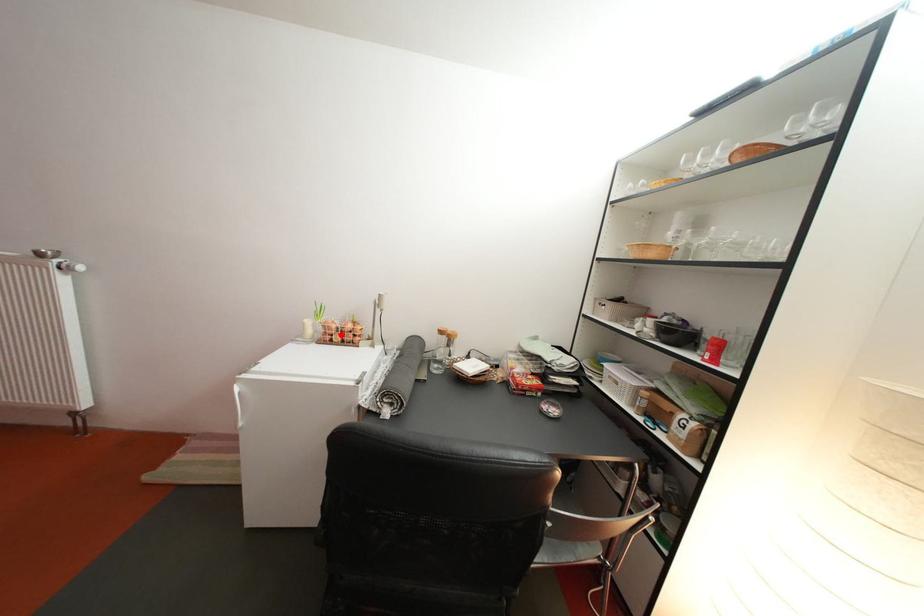
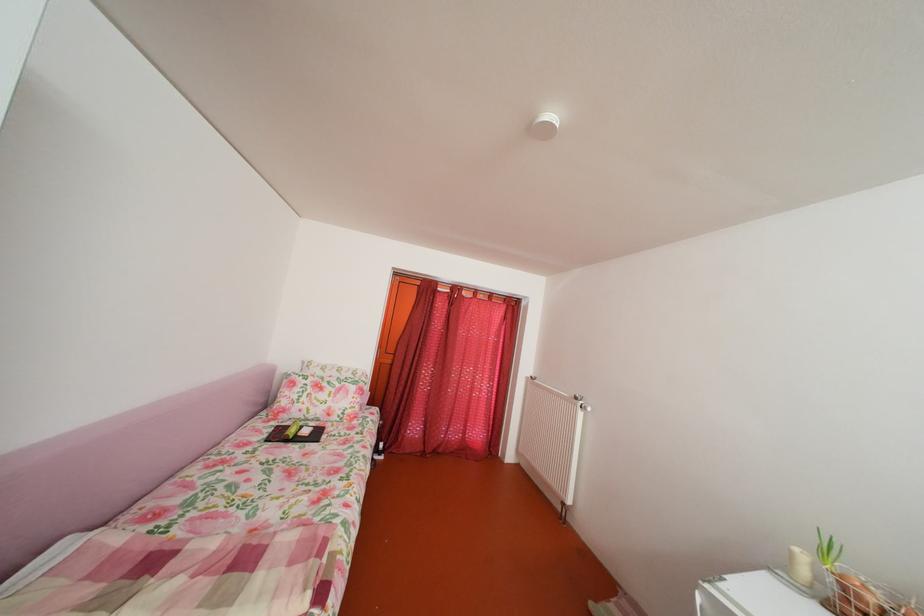
Find the pixel in the second image that matches the highlighted location in the first image.

(871, 605)